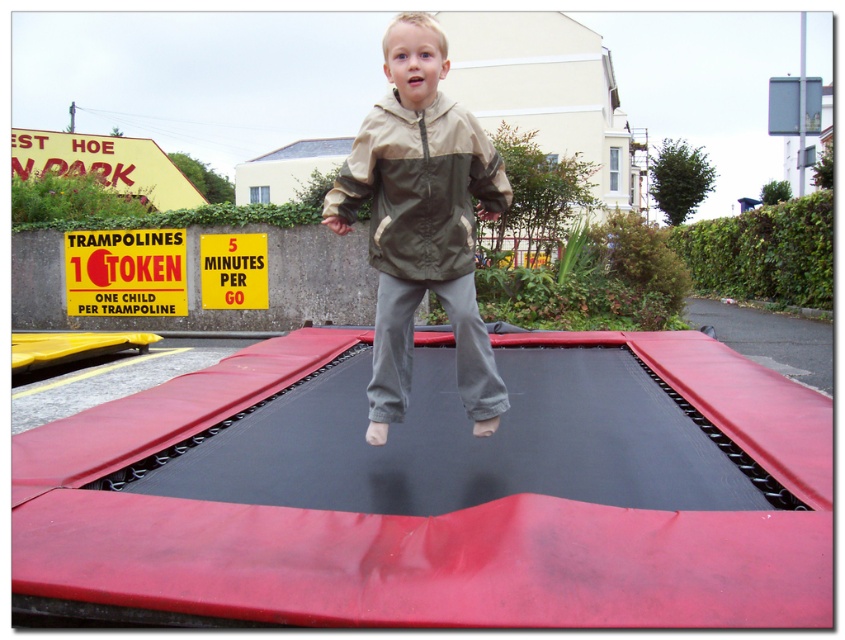
Who is more distant from viewer, (420,260) or (330,202)?

Positioned behind is point (330,202).

You are a GUI agent. You are given a task and a screenshot of the screen. Output one action in this format:
    pyautogui.click(x=<x>, y=<y>)
    Task: Click on the khaki fabric jacket at center
    
    Given the screenshot: What is the action you would take?
    pyautogui.click(x=422, y=221)